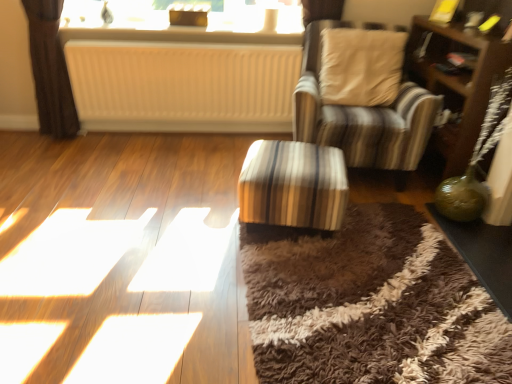
In order to face white textured radiator at upper center, should I rotate leftwards or rightwards?

You should rotate left by 9.498 degrees.

In order to click on striped fabric ottoman at center, positioned as the 2th table in right-to-left order in this screenshot , I will do `click(293, 185)`.

Image resolution: width=512 pixels, height=384 pixels. Identify the location of brown wooden dresser at right. (456, 82).

In order to face brown wooden dresser at right, should I rotate leftwards or rightwards?

A 24.354 degree turn to the right will do.

The image size is (512, 384). Find the location of `green glass table at lower right, arranged as the first table when viewed from the right`. green glass table at lower right, arranged as the first table when viewed from the right is located at coordinates (483, 254).

At what (x,y) coordinates should I click in order to perform the action: click on white ribbed radiator at center. Please return your answer as a coordinate pair (x, y). Looking at the image, I should click on (183, 86).

Is striped fabric ottoman at center, positioned as the 2th table in right-to-left order, taller or shorter than white textured radiator at upper center?

striped fabric ottoman at center, positioned as the 2th table in right-to-left order, is taller than white textured radiator at upper center.

Based on the photo, which point is more forward, [306,149] or [265,33]?

Positioned in front is point [306,149].

Measure the distance between striped fabric ottoman at center, positioned as the 2th table in right-to-left order, and white textured radiator at upper center.

They are 4.31 feet apart.

From the image's perspective, does striped fabric ottoman at center, which ranks as the first table in left-to-right order, appear lower than white textured radiator at upper center?

Yes, from the image's perspective, striped fabric ottoman at center, which ranks as the first table in left-to-right order, is beneath white textured radiator at upper center.

Does green glass table at lower right, the second table when ordered from left to right, have a larger size compared to white ribbed radiator at center?

No.

Considering the sizes of objects green glass table at lower right, the second table when ordered from left to right, and white ribbed radiator at center in the image provided, who is taller, green glass table at lower right, the second table when ordered from left to right, or white ribbed radiator at center?

white ribbed radiator at center is taller.

Which of these two, green glass table at lower right, arranged as the first table when viewed from the right, or white ribbed radiator at center, is wider?

green glass table at lower right, arranged as the first table when viewed from the right.

Could you measure the distance between striped fabric ottoman at center, positioned as the 2th table in right-to-left order, and white ribbed radiator at center?

striped fabric ottoman at center, positioned as the 2th table in right-to-left order, is 3.80 feet away from white ribbed radiator at center.

Does striped fabric ottoman at center, which ranks as the first table in left-to-right order, lie in front of white ribbed radiator at center?

That is True.

From the image's perspective, is striped fabric ottoman at center, which ranks as the first table in left-to-right order, located above white ribbed radiator at center?

No, from the image's perspective, striped fabric ottoman at center, which ranks as the first table in left-to-right order, is not above white ribbed radiator at center.

Can you confirm if striped fabric ottoman at center, positioned as the 2th table in right-to-left order, is bigger than white ribbed radiator at center?

No.

Is brown wooden dresser at right not close to striped fabric chair at center?

No, brown wooden dresser at right is in close proximity to striped fabric chair at center.

Does point (468, 113) appear closer or farther from the camera than point (303, 63)?

Clearly, point (468, 113) is closer to the camera than point (303, 63).

Is brown wooden dresser at right not within striped fabric chair at center?

Yes, brown wooden dresser at right is outside of striped fabric chair at center.

Which of these two, brown wooden dresser at right or striped fabric chair at center, is smaller?

brown wooden dresser at right.

Based on their positions, is white textured radiator at upper center located to the left or right of brown wooden dresser at right?

In the image, white textured radiator at upper center appears on the left side of brown wooden dresser at right.

The width and height of the screenshot is (512, 384). Find the location of `dresser located below the white textured radiator at upper center (from the image's perspective)`. dresser located below the white textured radiator at upper center (from the image's perspective) is located at coordinates (456, 82).

From a real-world perspective, which object stands above the other?

white textured radiator at upper center.

Looking at this image, how many degrees apart are the facing directions of white textured radiator at upper center and brown wooden dresser at right?

The facing directions of white textured radiator at upper center and brown wooden dresser at right are 87.6 degrees apart.

Where is `the 1st table below the striped fabric chair at center (from the image's perspective)`? This screenshot has width=512, height=384. the 1st table below the striped fabric chair at center (from the image's perspective) is located at coordinates (293, 185).

In the scene shown: Is striped fabric chair at center next to striped fabric ottoman at center, positioned as the 2th table in right-to-left order, and touching it?

No, striped fabric chair at center is not beside striped fabric ottoman at center, positioned as the 2th table in right-to-left order.

From a real-world perspective, is striped fabric chair at center positioned under striped fabric ottoman at center, positioned as the 2th table in right-to-left order, based on gravity?

No.

From the image's perspective, starting from the brown wooden dresser at right, which table is the 1st one below? Please provide its 2D coordinates.

[(293, 185)]

Which object is wider, brown wooden dresser at right or striped fabric ottoman at center, positioned as the 2th table in right-to-left order?

With larger width is striped fabric ottoman at center, positioned as the 2th table in right-to-left order.

Is striped fabric ottoman at center, positioned as the 2th table in right-to-left order, at the back of brown wooden dresser at right?

No, striped fabric ottoman at center, positioned as the 2th table in right-to-left order, is not at the back of brown wooden dresser at right.

From a real-world perspective, which is physically above, brown wooden dresser at right or striped fabric ottoman at center, which ranks as the first table in left-to-right order?

In real-world perspective, brown wooden dresser at right is above.

The height and width of the screenshot is (384, 512). What are the coordinates of `window behind the striped fabric ottoman at center, which ranks as the first table in left-to-right order` in the screenshot? It's located at (177, 26).

Identify the location of the 2nd table directly beneath the white ribbed radiator at center (from a real-world perspective). The width and height of the screenshot is (512, 384). (483, 254).

When comparing their distances from striped fabric ottoman at center, positioned as the 2th table in right-to-left order, does striped fabric chair at center or white textured radiator at upper center seem closer?

striped fabric chair at center is closer to striped fabric ottoman at center, positioned as the 2th table in right-to-left order.

When comparing their distances from striped fabric ottoman at center, positioned as the 2th table in right-to-left order, does striped fabric chair at center or white ribbed radiator at center seem closer?

striped fabric chair at center is positioned closer to the anchor striped fabric ottoman at center, positioned as the 2th table in right-to-left order.

Estimate the real-world distances between objects in this image. Which object is closer to white textured radiator at upper center, striped fabric ottoman at center, positioned as the 2th table in right-to-left order, or brown wooden dresser at right?

brown wooden dresser at right.

From the image, which object appears to be nearer to white ribbed radiator at center, white textured radiator at upper center or striped fabric ottoman at center, which ranks as the first table in left-to-right order?

white textured radiator at upper center is positioned closer to the anchor white ribbed radiator at center.

Which object lies nearer to the anchor point striped fabric ottoman at center, which ranks as the first table in left-to-right order, white textured radiator at upper center or white ribbed radiator at center?

white ribbed radiator at center is closer to striped fabric ottoman at center, which ranks as the first table in left-to-right order.

Considering their positions, is white ribbed radiator at center positioned further to striped fabric chair at center than brown wooden dresser at right?

Among the two, white ribbed radiator at center is located further to striped fabric chair at center.

Which object lies further to the anchor point brown wooden dresser at right, white textured radiator at upper center or white ribbed radiator at center?

Based on the image, white ribbed radiator at center appears to be further to brown wooden dresser at right.

From the image, which object appears to be nearer to green glass table at lower right, arranged as the first table when viewed from the right, striped fabric ottoman at center, which ranks as the first table in left-to-right order, or striped fabric chair at center?

striped fabric chair at center is closer to green glass table at lower right, arranged as the first table when viewed from the right.

What are the coordinates of `radiator between white textured radiator at upper center and striped fabric ottoman at center, which ranks as the first table in left-to-right order, vertically` in the screenshot? It's located at click(183, 86).

Find the location of `dresser between striped fabric chair at center and green glass table at lower right, arranged as the first table when viewed from the right, from top to bottom`. dresser between striped fabric chair at center and green glass table at lower right, arranged as the first table when viewed from the right, from top to bottom is located at coordinates (456, 82).

I want to click on chair between white ribbed radiator at center and green glass table at lower right, arranged as the first table when viewed from the right, so click(362, 118).

The width and height of the screenshot is (512, 384). What are the coordinates of `chair located between striped fabric ottoman at center, which ranks as the first table in left-to-right order, and brown wooden dresser at right in the left-right direction` in the screenshot? It's located at (362, 118).